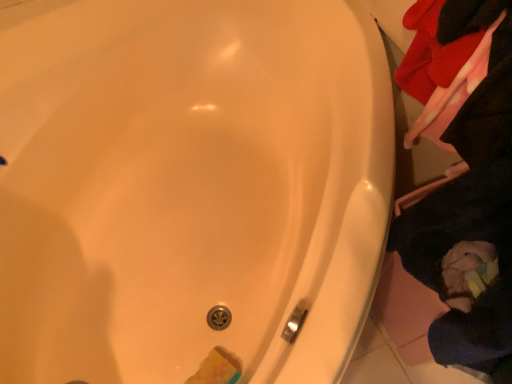
What do you see at coordinates (470, 209) in the screenshot?
I see `velvet-like pink towel at right` at bounding box center [470, 209].

Where is `velvet-like pink towel at right`? Image resolution: width=512 pixels, height=384 pixels. velvet-like pink towel at right is located at coordinates (470, 209).

The width and height of the screenshot is (512, 384). What are the coordinates of `velvet-like pink towel at right` in the screenshot? It's located at (470, 209).